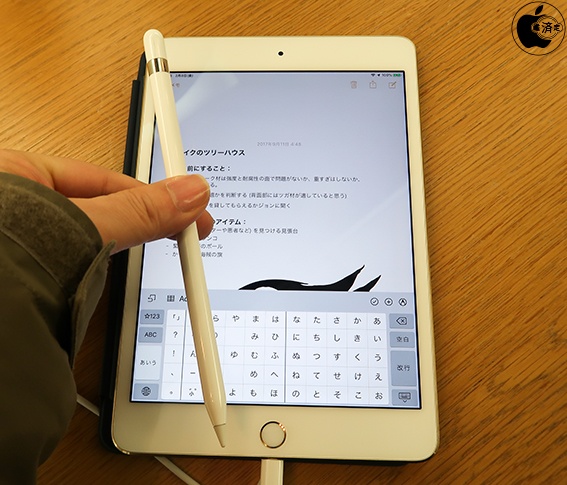
You are a GUI agent. You are given a task and a screenshot of the screen. Output one action in this format:
    pyautogui.click(x=<x>, y=<y>)
    Task: Click on the charger
    Image resolution: width=567 pixels, height=485 pixels.
    Given the screenshot: What is the action you would take?
    pyautogui.click(x=272, y=471)